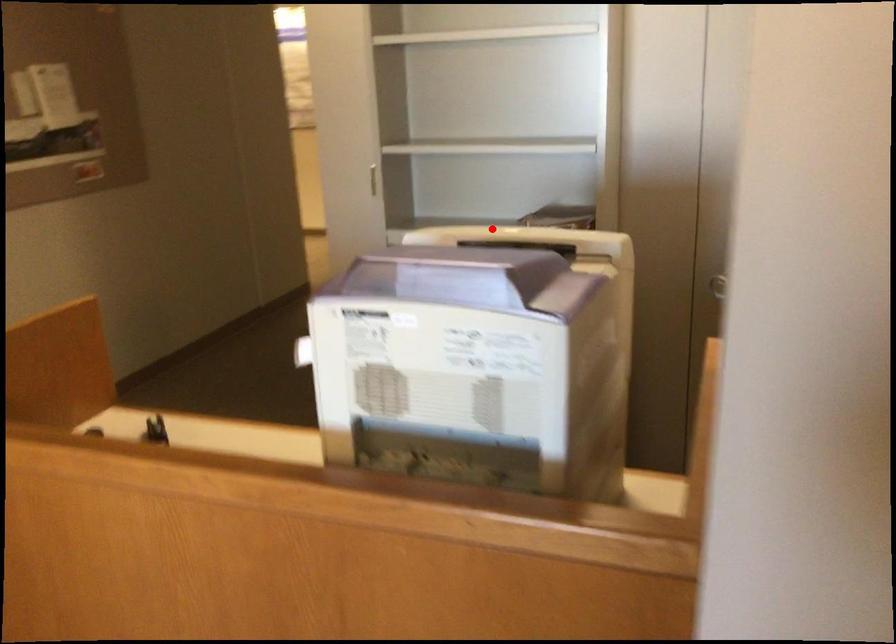
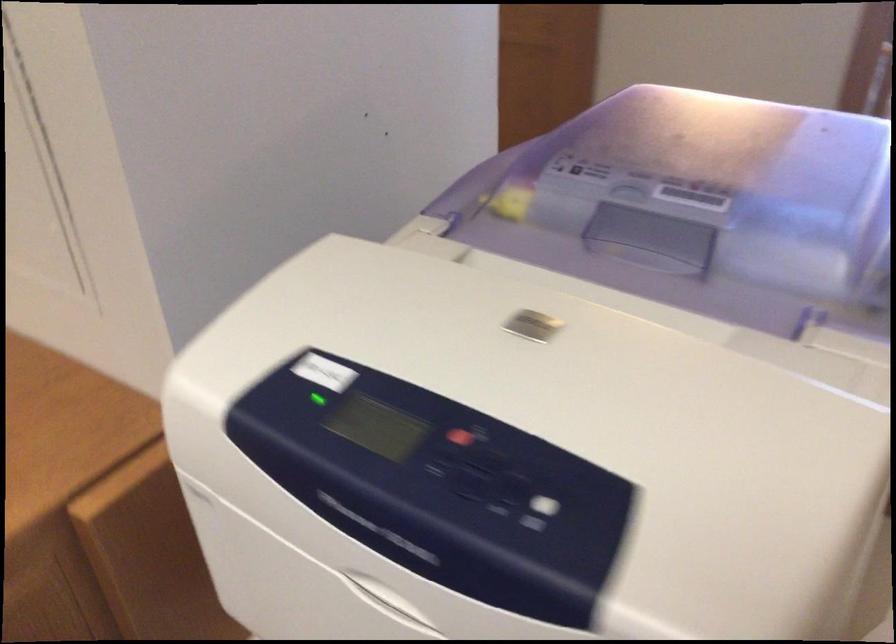
Question: A red point is marked in image1. In image2, is the corresponding 3D point closer to the camera or farther? Reply with the corresponding letter.

Choices:
 (A) The corresponding 3D point is closer.
 (B) The corresponding 3D point is farther.

Answer: (A)